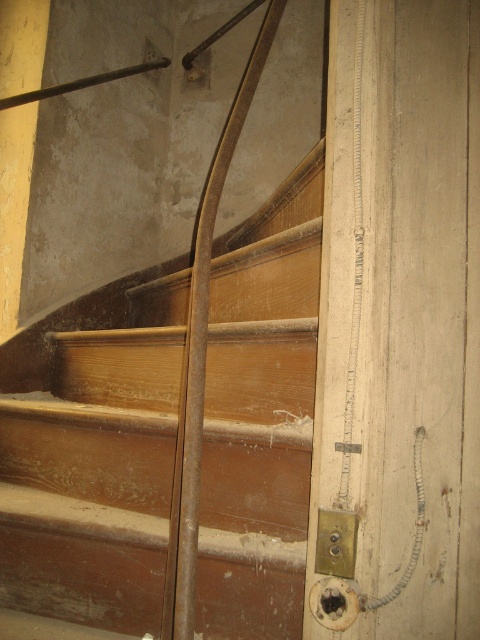
Can you confirm if brown wooden stairs at center is positioned to the left of gold metallic lock at lower right?

Correct, you'll find brown wooden stairs at center to the left of gold metallic lock at lower right.

Who is more forward, [216,285] or [355,557]?

Point [355,557] is more forward.

Does point (25, 442) come in front of point (330, 556)?

That is False.

This screenshot has width=480, height=640. I want to click on brown wooden stairs at center, so click(x=96, y=468).